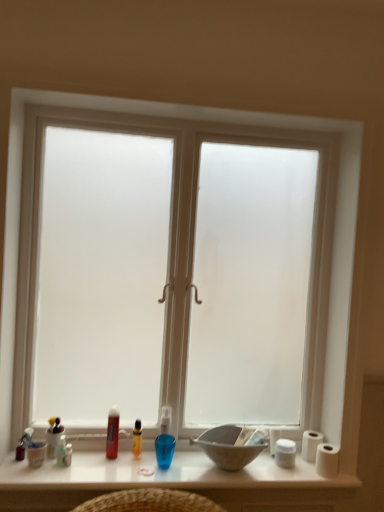
Question: From the image's perspective, is translucent plastic bottle at center, marked as the fifth toiletry in a left-to-right arrangement, located above or below matte white cup at lower left, the 4th toiletry viewed from the right?

Choices:
 (A) below
 (B) above

Answer: (B)

Question: Based on their positions, is translucent plastic bottle at center, marked as the fifth toiletry in a left-to-right arrangement, located to the left or right of matte white cup at lower left, the 4th toiletry viewed from the right?

Choices:
 (A) left
 (B) right

Answer: (B)

Question: Based on their relative distances, which object is farther from the white matte toilet paper at right, the first toilet paper positioned from the front?

Choices:
 (A) translucent plastic container at lower left, which is counted as the fifth toiletry, starting from the right
 (B) matte gray bowl at center
 (C) white glossy table at lower center
 (D) frosted glass window at center
 (E) translucent plastic tube at lower center, which is counted as the second toiletry, starting from the right

Answer: (A)

Question: Considering the real-world distances, which object is farthest from the translucent plastic container at lower left, which is counted as the fifth toiletry, starting from the right?

Choices:
 (A) translucent plastic bottle at lower left, which appears as the third toiletry when viewed from the right
 (B) translucent plastic tube at lower center, which is counted as the second toiletry, starting from the right
 (C) white matte toilet paper at right, which is the 1th toilet paper from back to front
 (D) translucent plastic bottle at center, arranged as the 1th toiletry when viewed from the right
 (E) white glossy table at lower center

Answer: (C)